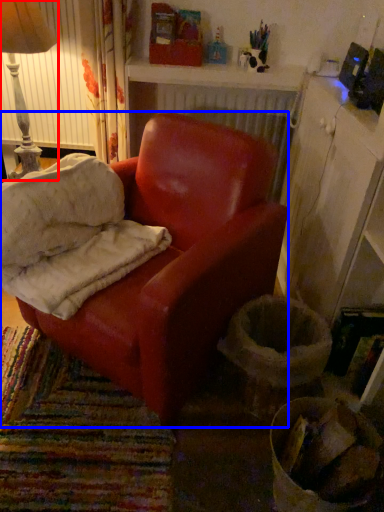
Question: Which of the following is the farthest to the observer, lamp (highlighted by a red box) or chair (highlighted by a blue box)?

Choices:
 (A) lamp
 (B) chair

Answer: (A)